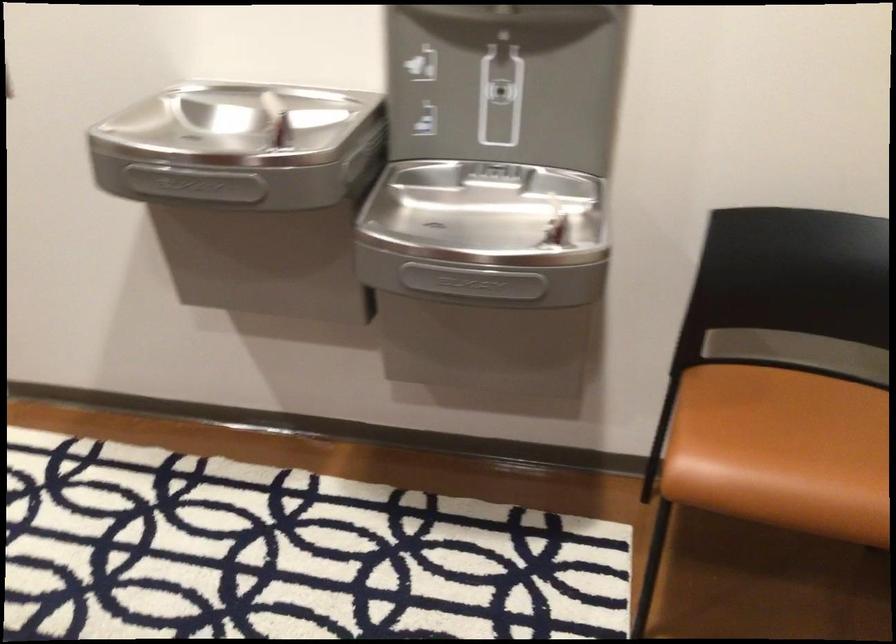
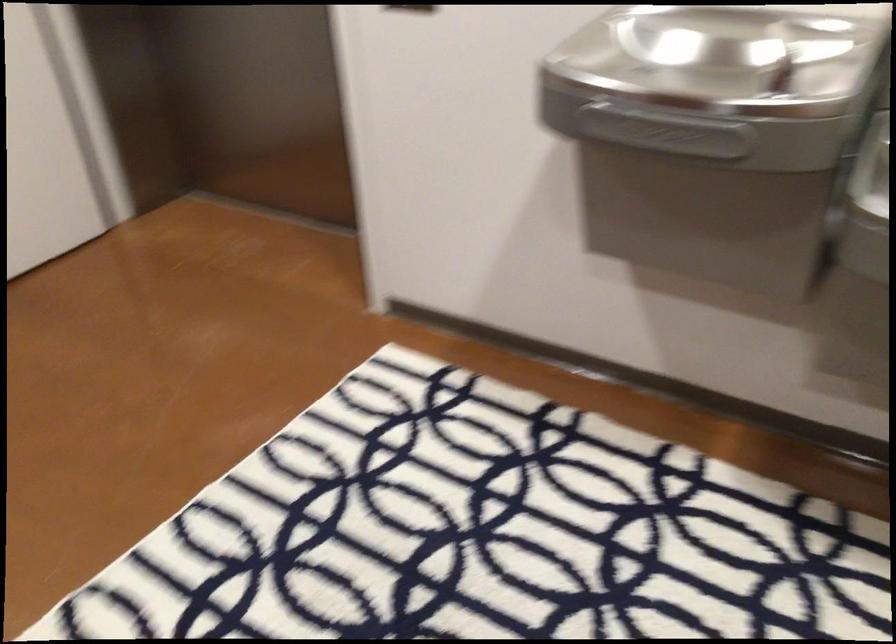
Question: The images are taken continuously from a first-person perspective. In which direction is your viewpoint rotating?

Choices:
 (A) Left
 (B) Right
 (C) Up
 (D) Down

Answer: (A)